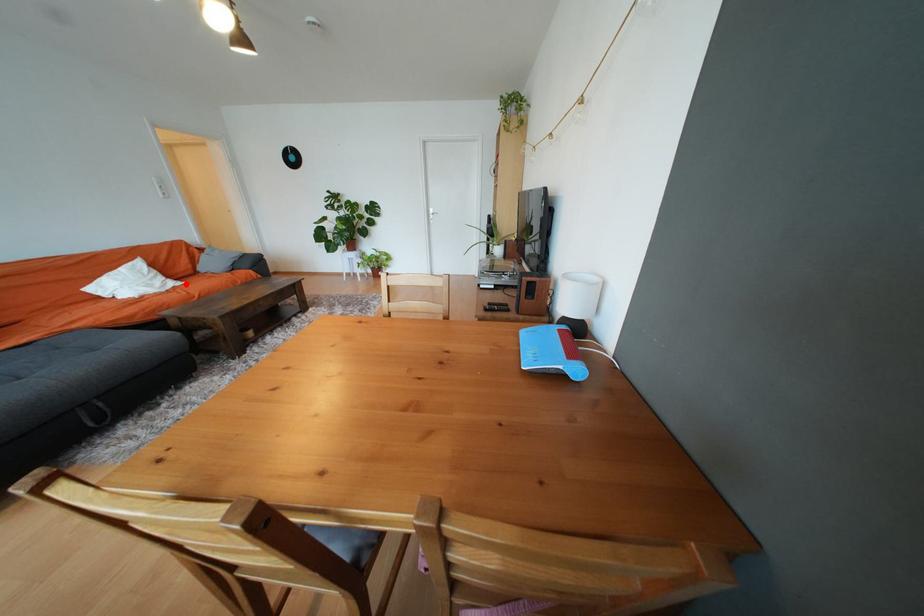
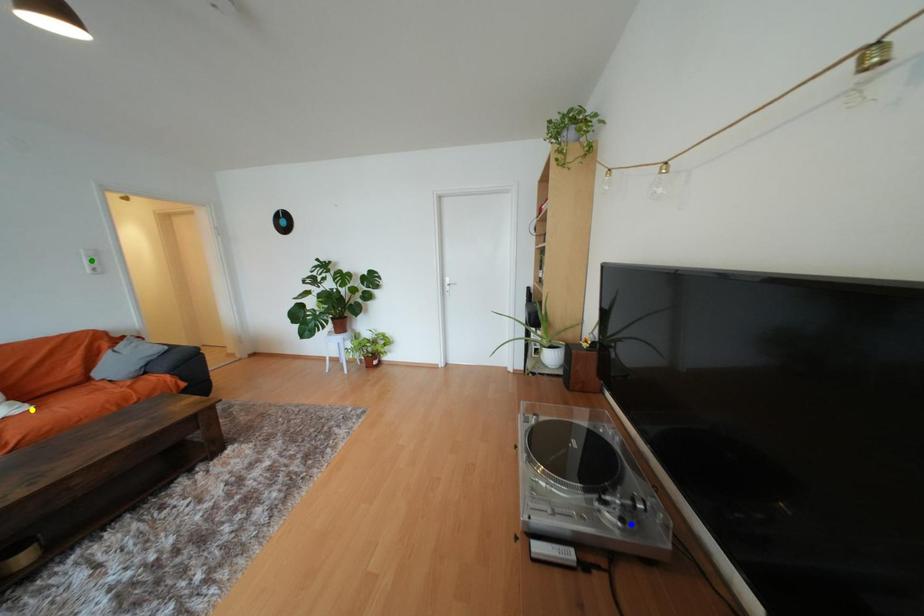
Question: I am providing you with two images of the same scene from different viewpoints. A red point is marked on the first image. You are given multiple points on the second image. Which point in image 2 is actually the same real-world point as the red point in image 1?

Choices:
 (A) yellow point
 (B) green point
 (C) blue point

Answer: (A)